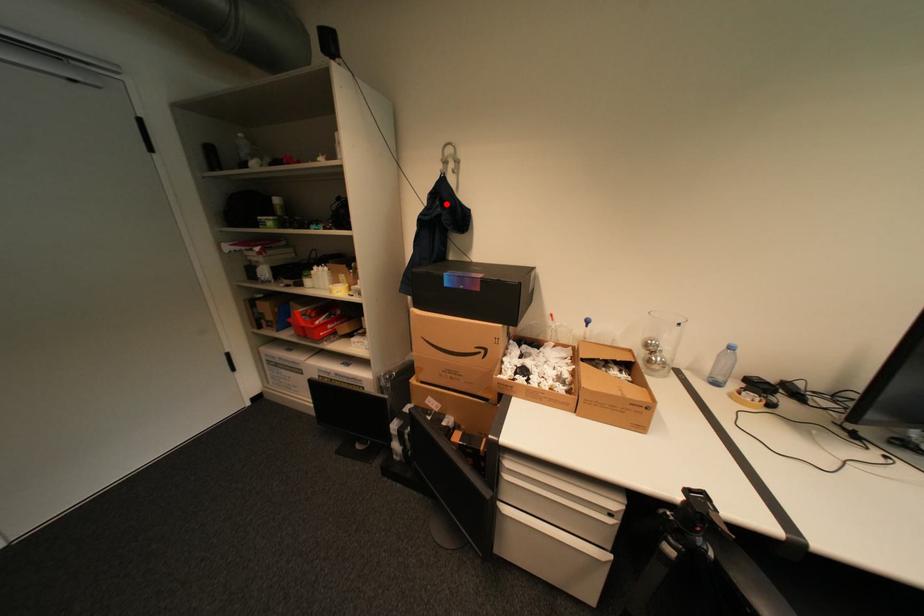
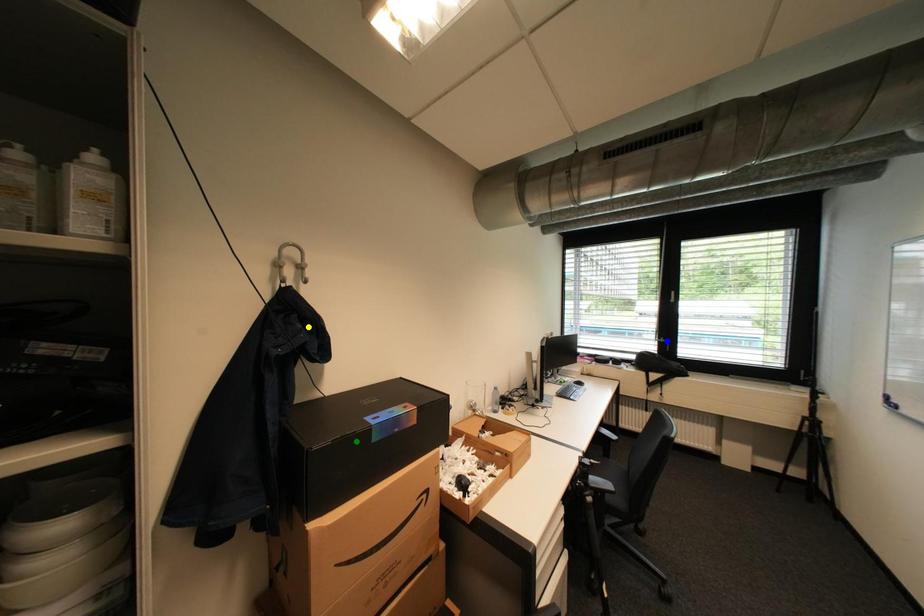
Question: I am providing you with two images of the same scene from different viewpoints. A red point is marked on the first image. You are given multiple points on the second image. Which mark in image 2 goes with the point in image 1?

Choices:
 (A) yellow point
 (B) blue point
 (C) green point

Answer: (A)